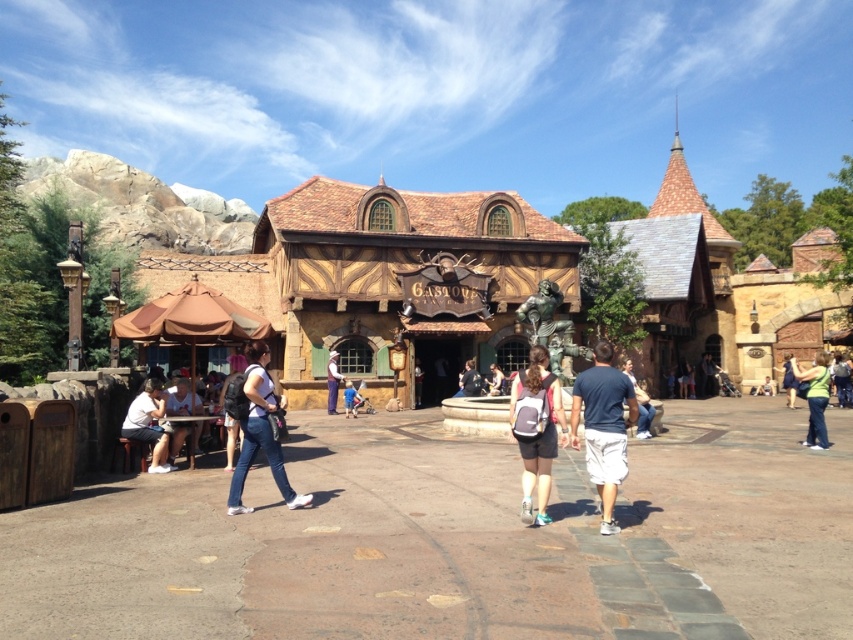
Question: Is wooden building at center smaller than light brown leather jacket at center?

Choices:
 (A) yes
 (B) no

Answer: (B)

Question: Estimate the real-world distances between objects in this image. Which object is farther from the light brown leather jacket at center?

Choices:
 (A) light blue jeans at center
 (B) green fabric backpack at lower right
 (C) blue jeans at center
 (D) gray fabric backpack at center

Answer: (A)

Question: Which point is closer to the camera?

Choices:
 (A) gray fabric backpack at center
 (B) light brown leather jacket at center

Answer: (A)

Question: Observing the image, what is the correct spatial positioning of white cotton shorts at lower right in reference to light brown leather jacket at center?

Choices:
 (A) above
 (B) below

Answer: (A)

Question: Which object is the closest to the white fabric shirt at lower left?

Choices:
 (A) matte black backpack at center
 (B) gray fabric backpack at center
 (C) light brown leather jacket at center
 (D) white shirt at center

Answer: (B)

Question: Does white cotton shorts at lower right have a smaller size compared to blue jeans at center?

Choices:
 (A) no
 (B) yes

Answer: (A)